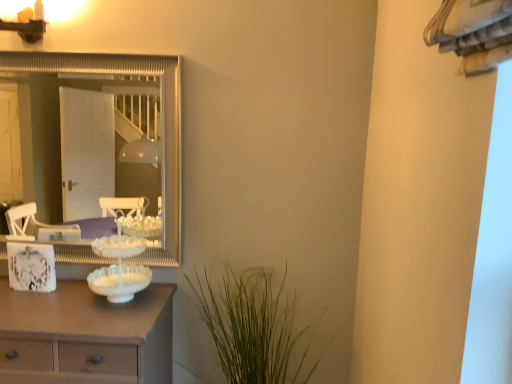
The height and width of the screenshot is (384, 512). I want to click on vacant space in front of matte white picture frame at left, so click(x=24, y=307).